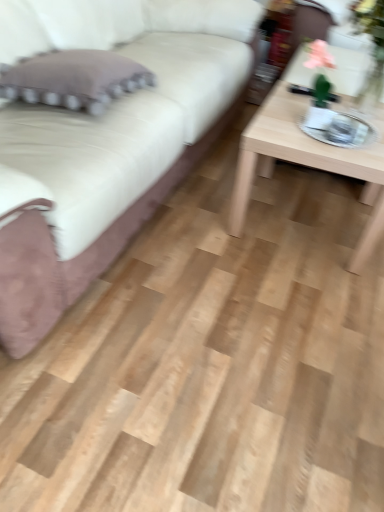
Question: Is velvet beige couch at upper left completely or partially outside of purple fabric pillow at left?

Choices:
 (A) yes
 (B) no

Answer: (A)

Question: Does velvet beige couch at upper left touch purple fabric pillow at left?

Choices:
 (A) no
 (B) yes

Answer: (A)

Question: Does velvet beige couch at upper left have a lesser width compared to purple fabric pillow at left?

Choices:
 (A) yes
 (B) no

Answer: (B)

Question: Is velvet beige couch at upper left at the right side of purple fabric pillow at left?

Choices:
 (A) no
 (B) yes

Answer: (A)

Question: Is purple fabric pillow at left inside velvet beige couch at upper left?

Choices:
 (A) yes
 (B) no

Answer: (A)

Question: Looking at the image, does velvet beige couch at upper left seem bigger or smaller compared to light wood/texture coffee table at right?

Choices:
 (A) big
 (B) small

Answer: (A)

Question: Is velvet beige couch at upper left situated inside light wood/texture coffee table at right or outside?

Choices:
 (A) outside
 (B) inside

Answer: (A)

Question: Is velvet beige couch at upper left wider or thinner than light wood/texture coffee table at right?

Choices:
 (A) wide
 (B) thin

Answer: (A)

Question: Is point (71, 182) closer or farther from the camera than point (231, 218)?

Choices:
 (A) closer
 (B) farther

Answer: (A)

Question: Based on their sizes in the image, would you say light wood/texture coffee table at right is bigger or smaller than purple fabric pillow at left?

Choices:
 (A) big
 (B) small

Answer: (A)

Question: Considering the positions of light wood/texture coffee table at right and purple fabric pillow at left in the image, is light wood/texture coffee table at right taller or shorter than purple fabric pillow at left?

Choices:
 (A) tall
 (B) short

Answer: (A)

Question: Which is correct: light wood/texture coffee table at right is inside purple fabric pillow at left, or outside of it?

Choices:
 (A) inside
 (B) outside

Answer: (B)

Question: Based on their positions, is light wood/texture coffee table at right located to the left or right of purple fabric pillow at left?

Choices:
 (A) right
 (B) left

Answer: (A)

Question: Based on their sizes in the image, would you say velvet beige couch at upper left is bigger or smaller than purple fabric pillow at left?

Choices:
 (A) small
 (B) big

Answer: (B)

Question: In terms of width, does velvet beige couch at upper left look wider or thinner when compared to purple fabric pillow at left?

Choices:
 (A) thin
 (B) wide

Answer: (B)